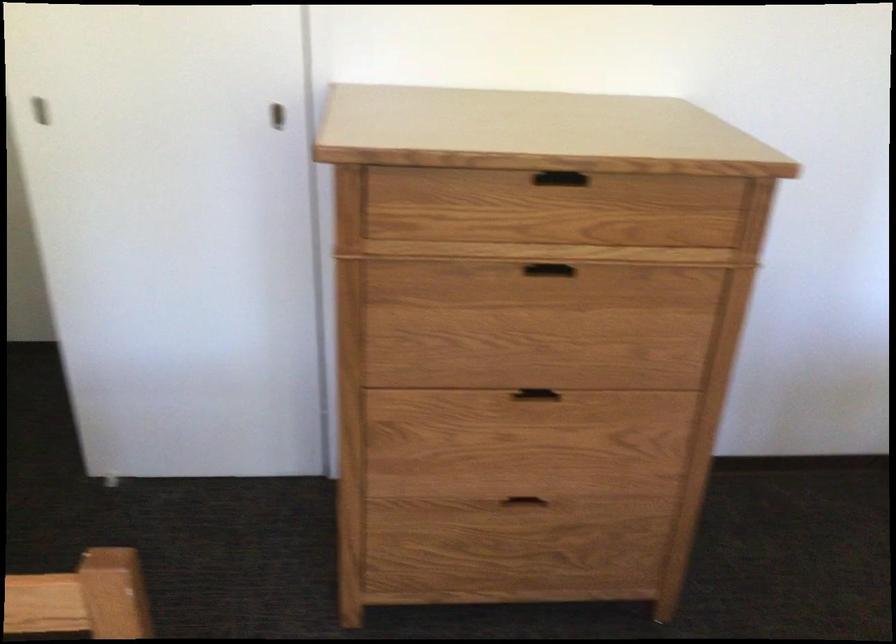
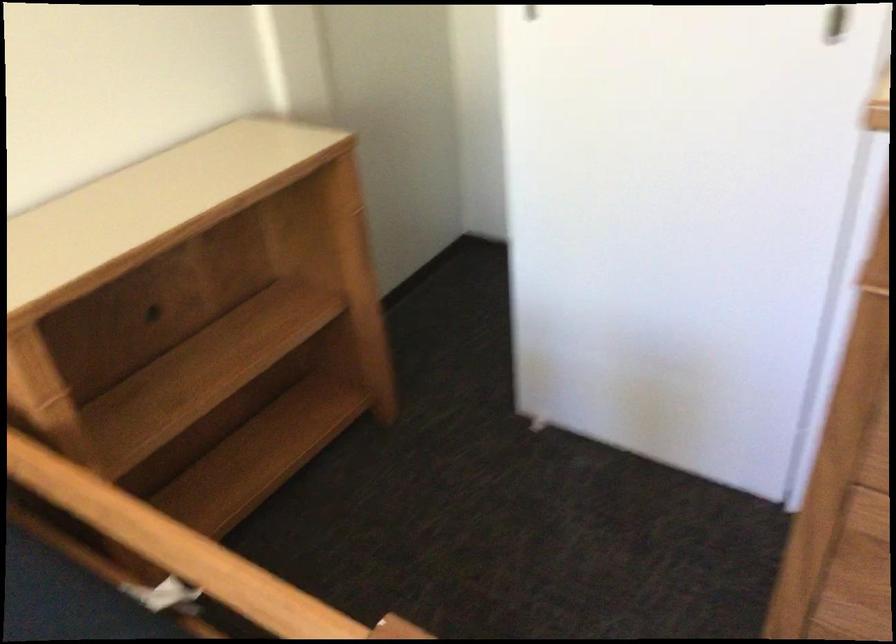
Question: Based on the continuous images, in which direction is the camera rotating? Reply with the corresponding letter.

Choices:
 (A) Left
 (B) Right
 (C) Up
 (D) Down

Answer: (A)